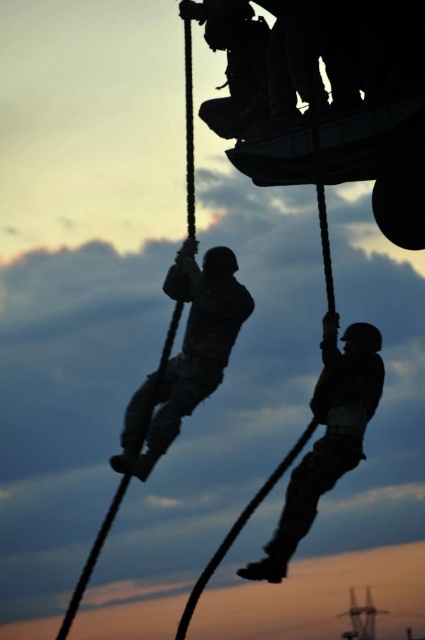
Consider the image. Between silhouette uniform at center and camouflage fabric soldier at right, which one is positioned higher?

silhouette uniform at center is higher up.

Does silhouette uniform at center appear over camouflage fabric soldier at right?

Yes.

Who is more forward, [201,355] or [243,566]?

Point [201,355] is more forward.

Locate an element on the screen. This screenshot has height=640, width=425. silhouette uniform at center is located at coordinates (187, 353).